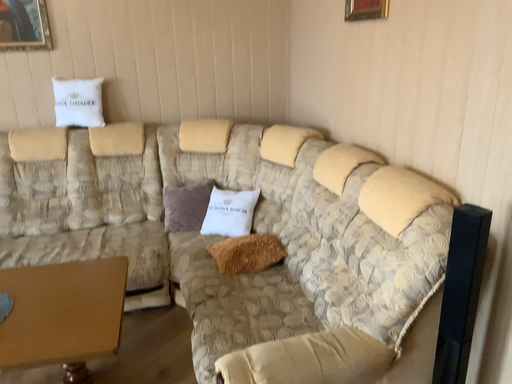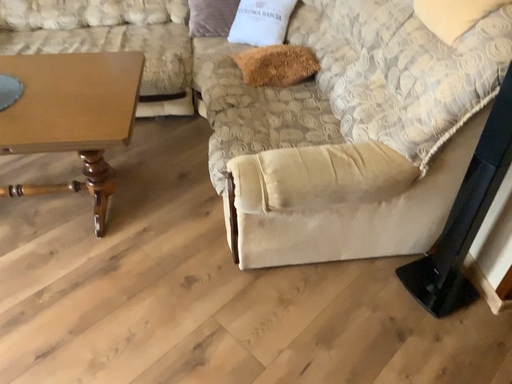
Question: Which way did the camera rotate in the video?

Choices:
 (A) rotated downward
 (B) rotated upward

Answer: (A)